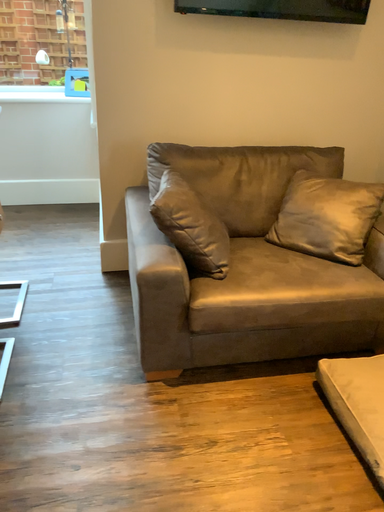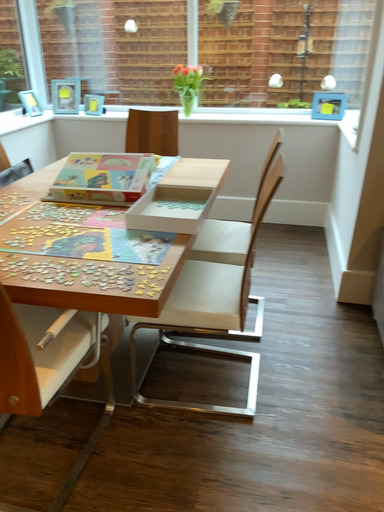
Question: How did the camera likely rotate when shooting the video?

Choices:
 (A) rotated left
 (B) rotated right

Answer: (A)